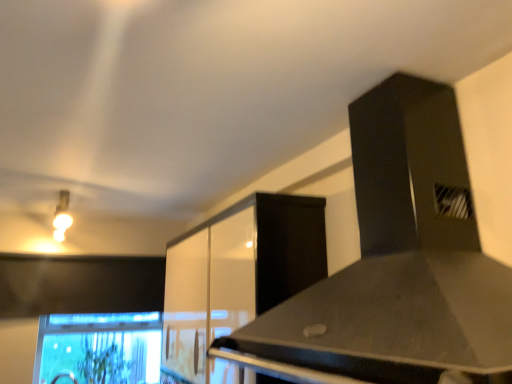
In order to face clear glass monitor at lower left, should I rotate leftwards or rightwards?

To face it directly, rotate left by 18.976 degrees.

What is the approximate height of matte gold light fixture at upper left?

The height of matte gold light fixture at upper left is 8.76 inches.

Where is `glossy white cabinet at center`? This screenshot has width=512, height=384. glossy white cabinet at center is located at coordinates (237, 278).

Does green leafy plant at lower left contain glossy white cabinet at center?

No, green leafy plant at lower left does not contain glossy white cabinet at center.

Who is taller, green leafy plant at lower left or glossy white cabinet at center?

glossy white cabinet at center.

Considering the points (96, 355) and (250, 310), which point is behind, point (96, 355) or point (250, 310)?

Positioned behind is point (96, 355).

Is glossy white cabinet at center touching green leafy plant at lower left?

No, glossy white cabinet at center is not beside green leafy plant at lower left.

This screenshot has width=512, height=384. I want to click on cabinetry above the green leafy plant at lower left (from the image's perspective), so click(237, 278).

From a real-world perspective, is glossy white cabinet at center physically located above or below green leafy plant at lower left?

glossy white cabinet at center is above green leafy plant at lower left.

Which is in front, point (168, 293) or point (88, 360)?

The point (168, 293) is closer to the camera.

Would you consider green leafy plant at lower left to be distant from clear glass monitor at lower left?

No, green leafy plant at lower left is not far away from clear glass monitor at lower left.

Considering the relative positions of green leafy plant at lower left and clear glass monitor at lower left in the image provided, is green leafy plant at lower left to the left of clear glass monitor at lower left from the viewer's perspective?

No.

Who is bigger, green leafy plant at lower left or clear glass monitor at lower left?

Bigger between the two is clear glass monitor at lower left.

Is green leafy plant at lower left turned away from clear glass monitor at lower left?

Yes.

Which object is more forward, clear glass monitor at lower left or black matte vent at upper right?

black matte vent at upper right is in front.

From a real-world perspective, who is located higher, clear glass monitor at lower left or black matte vent at upper right?

black matte vent at upper right, from a real-world perspective.

In the scene shown: From the image's perspective, is clear glass monitor at lower left located above black matte vent at upper right?

No, from the image's perspective, clear glass monitor at lower left is not above black matte vent at upper right.

At what (x,y) coordinates should I click in order to perform the action: click on light fixture above the black matte vent at upper right (from a real-world perspective). Please return your answer as a coordinate pair (x, y). This screenshot has width=512, height=384. Looking at the image, I should click on (62, 216).

How many degrees apart are the facing directions of black matte vent at upper right and matte gold light fixture at upper left?

The angular difference between black matte vent at upper right and matte gold light fixture at upper left is 88.6 degrees.

Between black matte vent at upper right and matte gold light fixture at upper left, which one has smaller width?

Thinner between the two is black matte vent at upper right.

Which object is further away from the camera taking this photo, black matte vent at upper right or matte gold light fixture at upper left?

matte gold light fixture at upper left is further from the camera.

Are clear glass monitor at lower left and matte gold light fixture at upper left located far from each other?

No, clear glass monitor at lower left is not far from matte gold light fixture at upper left.

Relative to matte gold light fixture at upper left, is clear glass monitor at lower left in front or behind?

clear glass monitor at lower left is behind matte gold light fixture at upper left.

From the image's perspective, which is below, clear glass monitor at lower left or matte gold light fixture at upper left?

clear glass monitor at lower left is shown below in the image.

Who is shorter, clear glass monitor at lower left or matte gold light fixture at upper left?

matte gold light fixture at upper left.

In terms of height, does green leafy plant at lower left look taller or shorter compared to matte gold light fixture at upper left?

green leafy plant at lower left is taller than matte gold light fixture at upper left.

From the image's perspective, which is below, green leafy plant at lower left or matte gold light fixture at upper left?

green leafy plant at lower left.

Is green leafy plant at lower left smaller than matte gold light fixture at upper left?

No, green leafy plant at lower left is not smaller than matte gold light fixture at upper left.

Where is `plant located on the left of glossy white cabinet at center`? The height and width of the screenshot is (384, 512). plant located on the left of glossy white cabinet at center is located at coordinates (104, 363).

Locate an element on the screen. This screenshot has width=512, height=384. plant that appears below the glossy white cabinet at center (from a real-world perspective) is located at coordinates (104, 363).

Looking at the image, which one is located further to green leafy plant at lower left, clear glass monitor at lower left or black matte vent at upper right?

black matte vent at upper right lies further to green leafy plant at lower left than the other object.

Estimate the real-world distances between objects in this image. Which object is further from matte gold light fixture at upper left, glossy white cabinet at center or green leafy plant at lower left?

Among the two, glossy white cabinet at center is located further to matte gold light fixture at upper left.

When comparing their distances from clear glass monitor at lower left, does matte gold light fixture at upper left or green leafy plant at lower left seem closer?

green leafy plant at lower left.

Based on their spatial positions, is green leafy plant at lower left or black matte vent at upper right closer to clear glass monitor at lower left?

Based on the image, green leafy plant at lower left appears to be nearer to clear glass monitor at lower left.

Consider the image. From the image, which object appears to be nearer to glossy white cabinet at center, clear glass monitor at lower left or green leafy plant at lower left?

clear glass monitor at lower left lies closer to glossy white cabinet at center than the other object.

Estimate the real-world distances between objects in this image. Which object is further from black matte vent at upper right, glossy white cabinet at center or clear glass monitor at lower left?

clear glass monitor at lower left lies further to black matte vent at upper right than the other object.

Which object lies nearer to the anchor point matte gold light fixture at upper left, glossy white cabinet at center or clear glass monitor at lower left?

clear glass monitor at lower left is closer to matte gold light fixture at upper left.

From the image, which object appears to be nearer to green leafy plant at lower left, clear glass monitor at lower left or glossy white cabinet at center?

clear glass monitor at lower left is closer to green leafy plant at lower left.

Identify the location of cabinetry located between black matte vent at upper right and clear glass monitor at lower left in the depth direction. This screenshot has width=512, height=384. (237, 278).

Identify the location of light fixture between glossy white cabinet at center and clear glass monitor at lower left along the z-axis. 62,216.

Where is `computer monitor between matte gold light fixture at upper left and green leafy plant at lower left vertically`? The width and height of the screenshot is (512, 384). computer monitor between matte gold light fixture at upper left and green leafy plant at lower left vertically is located at coordinates (99, 348).

Identify the location of light fixture between black matte vent at upper right and clear glass monitor at lower left in the front-back direction. (62, 216).